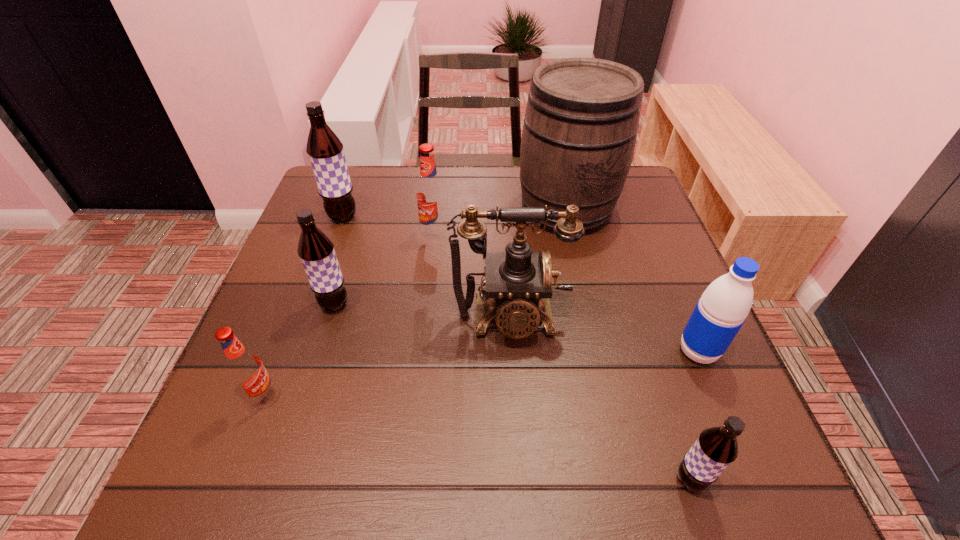
The width and height of the screenshot is (960, 540). What are the coordinates of `free space that satisfies the following two spatial constraints: 1. on the front side of the third farthest root beer; 2. on the left side of the nearest root beer` in the screenshot? It's located at (280, 480).

Find the location of a particular element. The height and width of the screenshot is (540, 960). vacant space that satisfies the following two spatial constraints: 1. on the front side of the farther red root beer; 2. on the left side of the rightmost object is located at coordinates (420, 352).

Identify the location of blank area in the image that satisfies the following two spatial constraints: 1. on the front side of the farther red root beer; 2. on the right side of the blue water bottle. The image size is (960, 540). (420, 352).